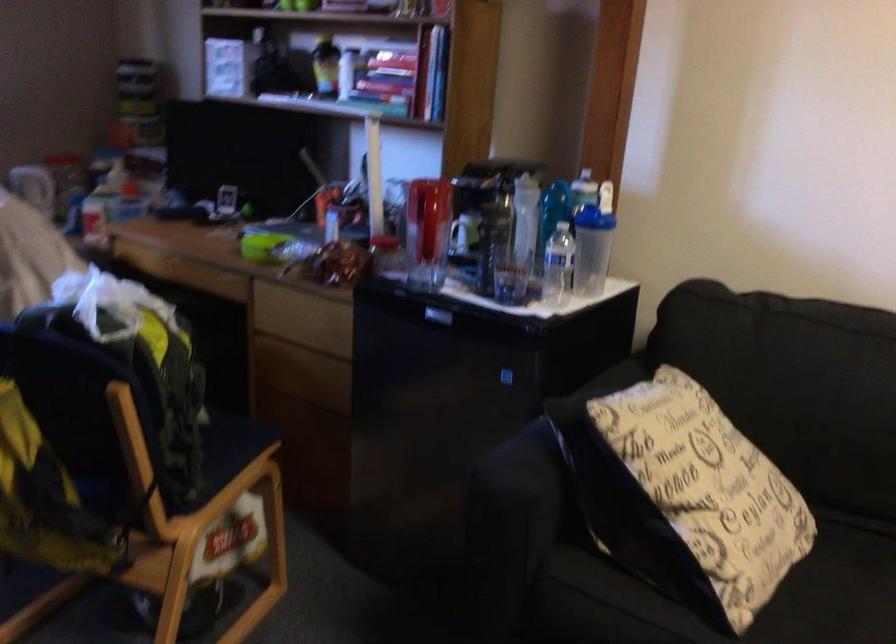
The width and height of the screenshot is (896, 644). I want to click on sofa sitting surface, so click(842, 603).